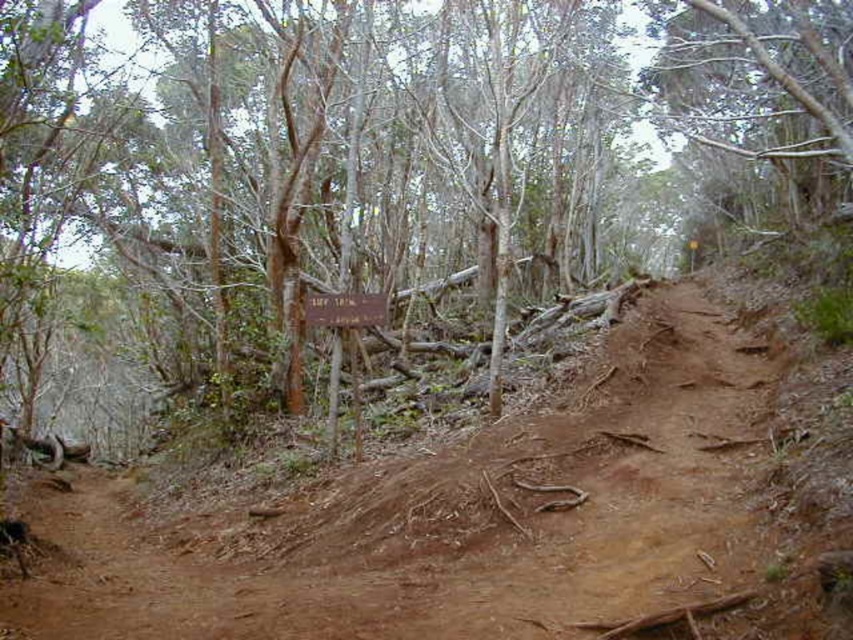
You are a hiker trying to read the wooden sign at center but you are standing on the brown dirt track at center. Can you easily read the sign from your current position?

The brown dirt track at center is closer to the viewer than the wooden sign at center, so you are standing closer to the track and further from the sign. This distance may make it difficult to read the sign clearly from your current position.

You are a hiker walking along the brown dirt track at center and the wooden sign at center. Which object is positioned to the right of the other?

The brown dirt track at center is to the right of the wooden sign at center.